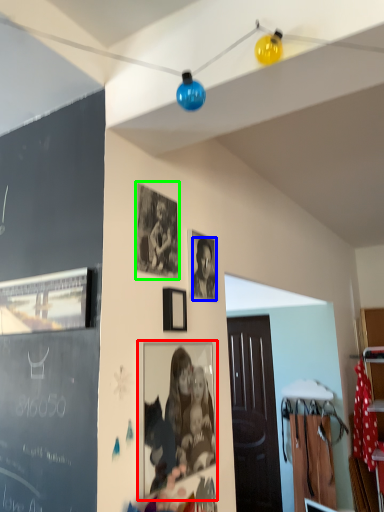
Question: Considering the real-world distances, which object is closest to picture frame (highlighted by a red box)? person (highlighted by a blue box) or picture frame (highlighted by a green box).

Choices:
 (A) person
 (B) picture frame

Answer: (A)